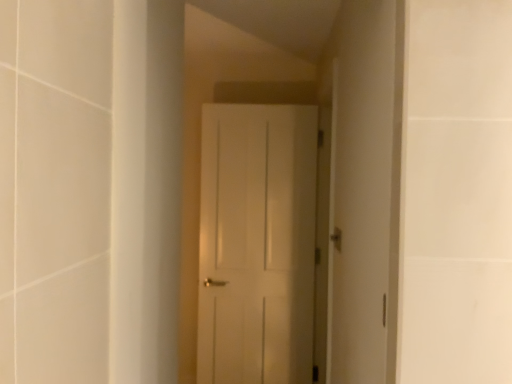
Describe the element at coordinates (257, 244) in the screenshot. I see `white matte door at center` at that location.

Locate an element on the screen. Image resolution: width=512 pixels, height=384 pixels. white matte door at center is located at coordinates (257, 244).

Where is `gold metallic door handle at center`? This screenshot has height=384, width=512. gold metallic door handle at center is located at coordinates (336, 238).

Describe the element at coordinates (336, 238) in the screenshot. The image size is (512, 384). I see `gold metallic door handle at center` at that location.

What is the approximate width of gold metallic door handle at center?

The width of gold metallic door handle at center is 4.39 centimeters.

The height and width of the screenshot is (384, 512). What are the coordinates of `white matte door at center` in the screenshot? It's located at (257, 244).

Which object is positioned more to the right, white matte door at center or gold metallic door handle at center?

gold metallic door handle at center.

Is white matte door at center closer to camera compared to gold metallic door handle at center?

No, white matte door at center is further to the viewer.

Considering the points (278, 253) and (337, 238), which point is in front, point (278, 253) or point (337, 238)?

The point (337, 238) is in front.

From the image's perspective, is white matte door at center located above or below gold metallic door handle at center?

white matte door at center is situated lower than gold metallic door handle at center in the image.

From a real-world perspective, is white matte door at center located beneath gold metallic door handle at center?

Indeed, from a real-world perspective, white matte door at center is positioned beneath gold metallic door handle at center.

Can you confirm if white matte door at center is wider than gold metallic door handle at center?

Indeed, white matte door at center has a greater width compared to gold metallic door handle at center.

Considering the sizes of white matte door at center and gold metallic door handle at center in the image, is white matte door at center taller or shorter than gold metallic door handle at center?

Considering their sizes, white matte door at center has more height than gold metallic door handle at center.

Who is smaller, white matte door at center or gold metallic door handle at center?

Smaller between the two is gold metallic door handle at center.

Is white matte door at center not inside gold metallic door handle at center?

Yes, white matte door at center is outside of gold metallic door handle at center.

Is the surface of white matte door at center in direct contact with gold metallic door handle at center?

white matte door at center is not next to gold metallic door handle at center, and they're not touching.

Is white matte door at center turned away from gold metallic door handle at center?

No.

How different are the orientations of white matte door at center and gold metallic door handle at center in degrees?

There is a 97.6-degree angle between the facing directions of white matte door at center and gold metallic door handle at center.

Locate an element on the screen. door below the gold metallic door handle at center (from a real-world perspective) is located at coordinates (257, 244).

Considering the relative positions of gold metallic door handle at center and white matte door at center in the image provided, is gold metallic door handle at center to the left of white matte door at center from the viewer's perspective?

In fact, gold metallic door handle at center is to the right of white matte door at center.

Is gold metallic door handle at center in front of or behind white matte door at center in the image?

Clearly, gold metallic door handle at center is in front of white matte door at center.

Considering the positions of point (337, 240) and point (268, 330), is point (337, 240) closer or farther from the camera than point (268, 330)?

Clearly, point (337, 240) is closer to the camera than point (268, 330).

From the image's perspective, between gold metallic door handle at center and white matte door at center, which one is located above?

From the image's view, gold metallic door handle at center is above.

From a real-world perspective, is gold metallic door handle at center over white matte door at center?

Yes, from a real-world perspective, gold metallic door handle at center is above white matte door at center.

Considering the sizes of gold metallic door handle at center and white matte door at center in the image, is gold metallic door handle at center wider or thinner than white matte door at center?

Considering their sizes, gold metallic door handle at center looks slimmer than white matte door at center.

Considering the relative sizes of gold metallic door handle at center and white matte door at center in the image provided, is gold metallic door handle at center shorter than white matte door at center?

Yes, gold metallic door handle at center is shorter than white matte door at center.

Between gold metallic door handle at center and white matte door at center, which one has larger size?

With larger size is white matte door at center.

Is gold metallic door handle at center inside or outside of white matte door at center?

The correct answer is: outside.

Is gold metallic door handle at center in contact with white matte door at center?

gold metallic door handle at center is not next to white matte door at center, and they're not touching.

Does gold metallic door handle at center turn towards white matte door at center?

No, gold metallic door handle at center is not oriented towards white matte door at center.

What's the angular difference between gold metallic door handle at center and white matte door at center's facing directions?

gold metallic door handle at center and white matte door at center are facing 97.6 degrees away from each other.

At what (x,y) coordinates should I click in order to perform the action: click on door behind the gold metallic door handle at center. Please return your answer as a coordinate pair (x, y). The image size is (512, 384). Looking at the image, I should click on (257, 244).

Locate an element on the screen. door below the gold metallic door handle at center (from a real-world perspective) is located at coordinates (257, 244).

In the image, there is a gold metallic door handle at center. In order to click on door below it (from the image's perspective) in this screenshot , I will do [x=257, y=244].